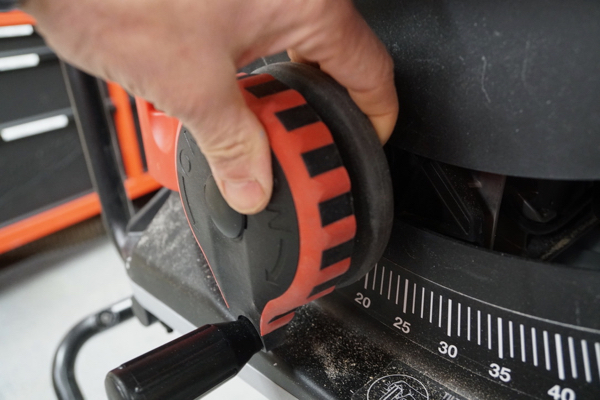
This screenshot has height=400, width=600. I want to click on floor, so click(40, 301), click(20, 383), click(109, 350), click(235, 390), click(92, 259), click(8, 307).